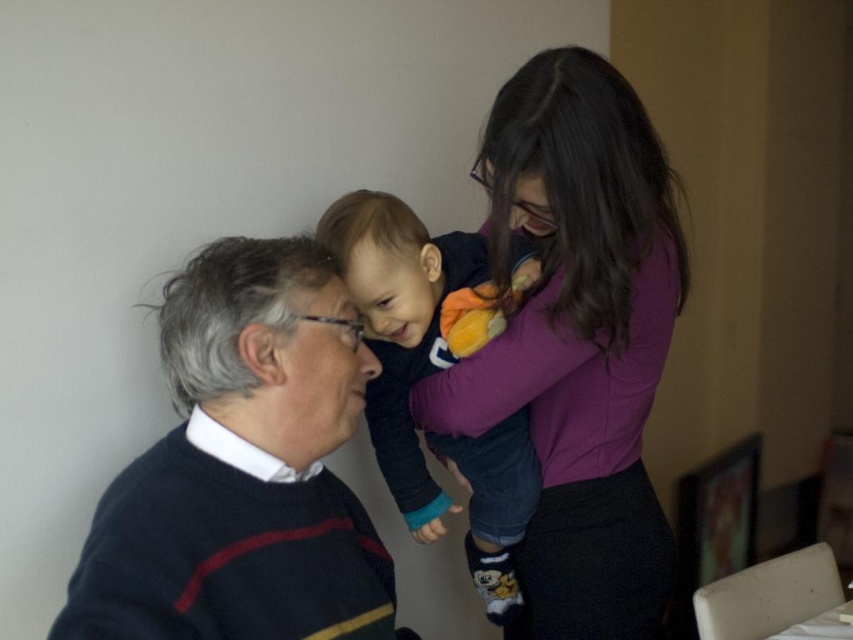
You are a fashion designer observing this scene. You notice two items of clothing, the dark blue sweater at left and the dark blue fleece at center. Which clothing item is positioned higher in the image?

The dark blue sweater at left is positioned higher in the image because it is above the dark blue fleece at center.

You are standing in the room and want to reach the point marked as point (573, 637). If your walking speed is 1.5 meters per second, how long will it take you to reach that point?

The distance between you and point (573, 637) is 1.41 meters. At a speed of 1.5 meters per second, it will take approximately 0.94 seconds to reach the point.

You are standing in the room and want to place a small plant pot at the location marked by point (577, 340). What object is currently at that location?

The point (577, 340) marks the location of the purple matte shirt at upper right, so placing a plant pot there would require moving the purple matte shirt at upper right first.